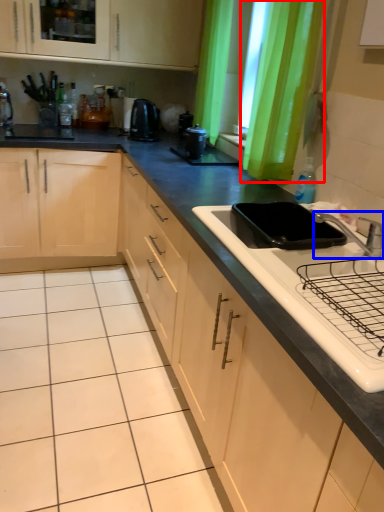
Question: Among these objects, which one is nearest to the camera, curtain (highlighted by a red box) or tap (highlighted by a blue box)?

Choices:
 (A) curtain
 (B) tap

Answer: (B)